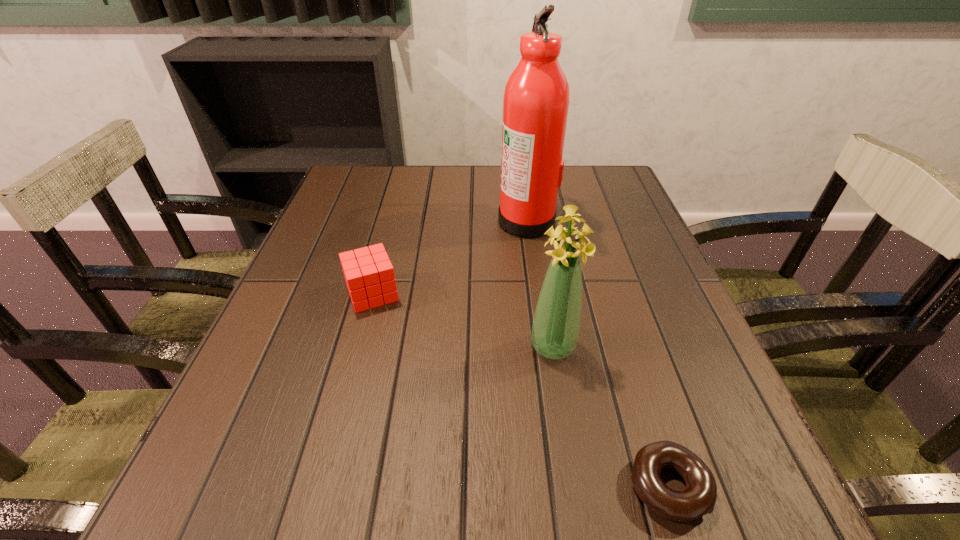
The height and width of the screenshot is (540, 960). Identify the location of free space that satisfies the following two spatial constraints: 1. on the front-facing side of the second tallest object; 2. on the right side of the rightmost object. (575, 486).

The width and height of the screenshot is (960, 540). I want to click on free location that satisfies the following two spatial constraints: 1. on the label side of the tallest object; 2. on the front side of the cube, so click(x=538, y=294).

This screenshot has height=540, width=960. What are the coordinates of `vacant space that satisfies the following two spatial constraints: 1. on the label side of the tallest object; 2. on the right side of the rightmost object` in the screenshot? It's located at (564, 486).

You are a GUI agent. You are given a task and a screenshot of the screen. Output one action in this format:
    pyautogui.click(x=<x>, y=<y>)
    Task: Click on the vacant point that satisfies the following two spatial constraints: 1. on the front-facing side of the third farthest object; 2. on the left side of the nearest object
    Image resolution: width=960 pixels, height=540 pixels.
    Given the screenshot: What is the action you would take?
    (x=575, y=486)